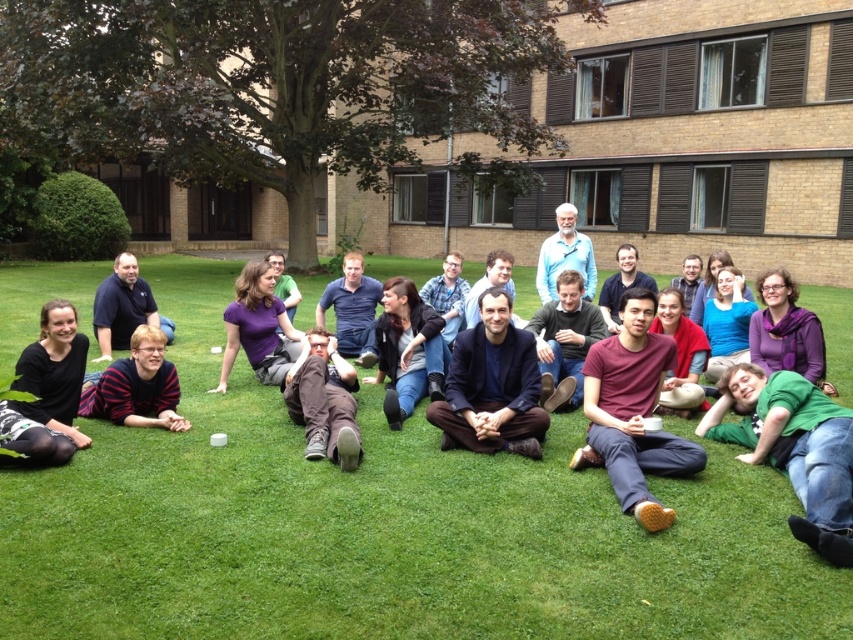
Question: Which point is closer to the camera taking this photo?

Choices:
 (A) (471, 372)
 (B) (828, 496)
 (C) (160, 349)
 (D) (596, 396)

Answer: (B)

Question: Is maroon cotton shirt at center above striped sweater at lower left?

Choices:
 (A) yes
 (B) no

Answer: (B)

Question: Which of the following is the farthest from the observer?

Choices:
 (A) dark blue fabric at center
 (B) maroon cotton shirt at center
 (C) brown suede pants at center

Answer: (A)

Question: Does green cotton shirt at lower right have a smaller size compared to brown suede pants at center?

Choices:
 (A) yes
 (B) no

Answer: (B)

Question: Considering the real-world distances, which object is closest to the green cotton shirt at lower right?

Choices:
 (A) brown suede pants at center
 (B) dark blue shirt at center
 (C) striped sweater at lower left

Answer: (A)

Question: Can you confirm if green cotton shirt at lower right is bigger than striped sweater at lower left?

Choices:
 (A) no
 (B) yes

Answer: (B)